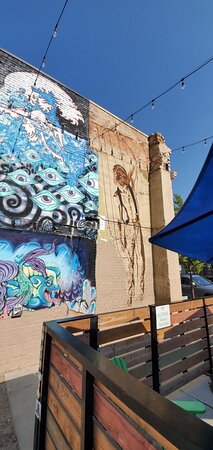
Identify the location of window. (165, 170).